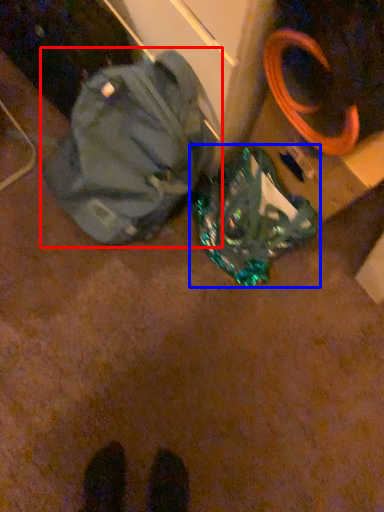
Question: Which of the following is the closest to the observer, backpack (highlighted by a red box) or luggage and bags (highlighted by a blue box)?

Choices:
 (A) backpack
 (B) luggage and bags

Answer: (A)